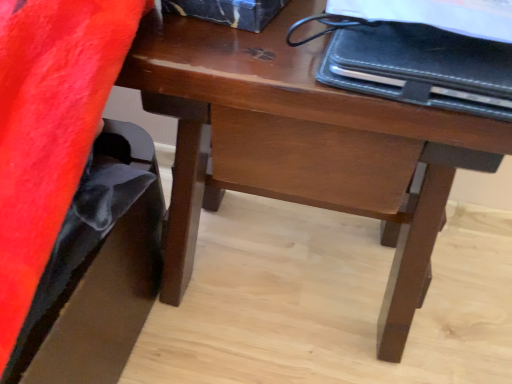
Question: Is black leather notebook at upper right positioned before wooden desk at center?

Choices:
 (A) no
 (B) yes

Answer: (B)

Question: Considering the relative sizes of black leather notebook at upper right and wooden desk at center in the image provided, is black leather notebook at upper right wider than wooden desk at center?

Choices:
 (A) yes
 (B) no

Answer: (B)

Question: From a real-world perspective, is black leather notebook at upper right over wooden desk at center?

Choices:
 (A) yes
 (B) no

Answer: (A)

Question: Could you tell me if black leather notebook at upper right is turned towards wooden desk at center?

Choices:
 (A) yes
 (B) no

Answer: (B)

Question: Is black leather notebook at upper right taller than wooden desk at center?

Choices:
 (A) no
 (B) yes

Answer: (A)

Question: Would you say wooden desk at center is part of black leather notebook at upper right's contents?

Choices:
 (A) yes
 (B) no

Answer: (B)

Question: Is wooden desk at center bigger than black leather notebook at upper right?

Choices:
 (A) no
 (B) yes

Answer: (B)

Question: From the image's perspective, is wooden desk at center over black leather notebook at upper right?

Choices:
 (A) yes
 (B) no

Answer: (B)

Question: Is wooden desk at center facing towards black leather notebook at upper right?

Choices:
 (A) no
 (B) yes

Answer: (A)

Question: Is wooden desk at center to the right of black leather notebook at upper right from the viewer's perspective?

Choices:
 (A) yes
 (B) no

Answer: (B)

Question: Is wooden desk at center positioned beyond the bounds of black leather notebook at upper right?

Choices:
 (A) yes
 (B) no

Answer: (A)

Question: Is wooden desk at center positioned with its back to black leather notebook at upper right?

Choices:
 (A) yes
 (B) no

Answer: (B)

Question: Looking at the image, does wooden desk at center seem bigger or smaller compared to black leather notebook at upper right?

Choices:
 (A) big
 (B) small

Answer: (A)